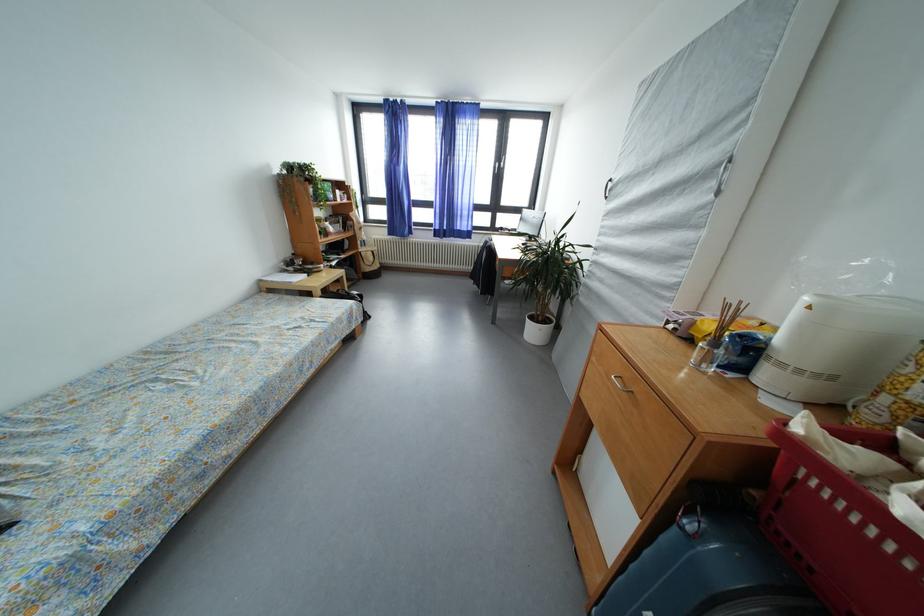
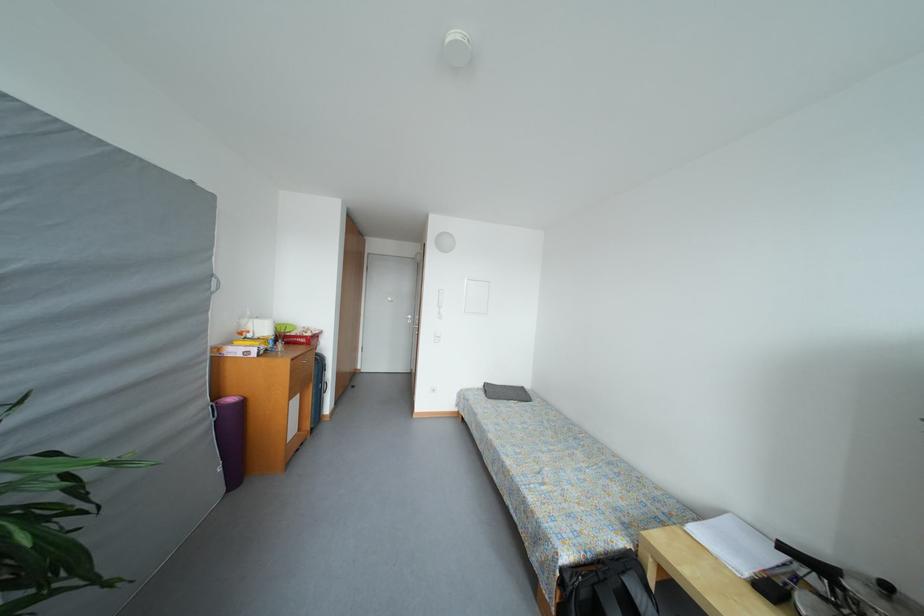
The point at (283,375) is marked in the first image. Where is the corresponding point in the second image?

(496, 440)